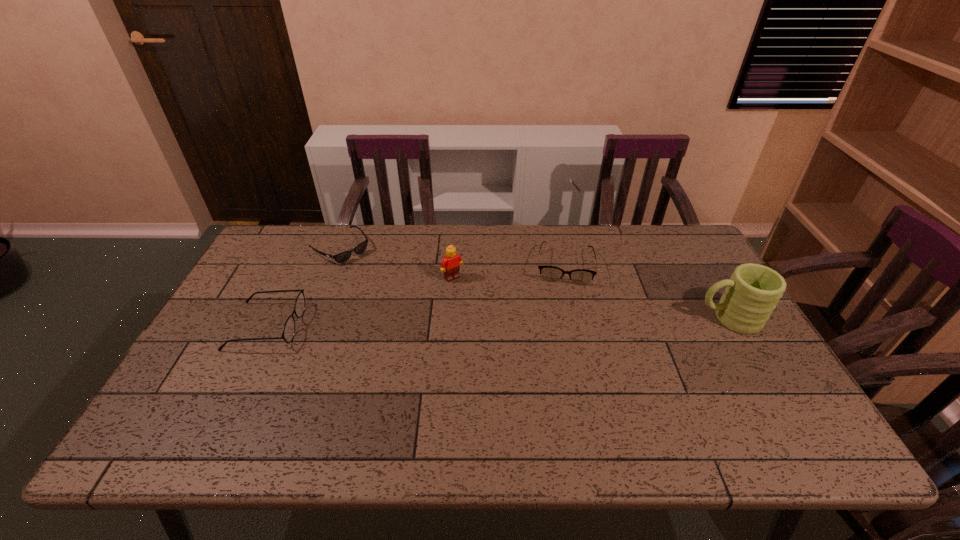
Identify the location of empty space that is in between the nearer spectacles and the fourth shortest object. The image size is (960, 540). (359, 302).

This screenshot has width=960, height=540. What are the coordinates of `free space between the tallest object and the third object from right to left` in the screenshot? It's located at (590, 298).

Locate an element on the screen. free space between the second tallest object and the sunglasses is located at coordinates (396, 262).

Locate an element on the screen. This screenshot has width=960, height=540. blank region between the sunglasses and the nearer spectacles is located at coordinates 303,287.

You are a GUI agent. You are given a task and a screenshot of the screen. Output one action in this format:
    pyautogui.click(x=<x>, y=<y>)
    Task: Click on the vacant space in between the mug and the fourth object from left to right
    
    Given the screenshot: What is the action you would take?
    pyautogui.click(x=646, y=292)

Where is `vacant area between the third object from left to right and the mug`? vacant area between the third object from left to right and the mug is located at coordinates (590, 298).

This screenshot has height=540, width=960. What are the coordinates of `free space that is in between the nearer spectacles and the mug` in the screenshot? It's located at (497, 322).

At what (x,y) coordinates should I click in order to perform the action: click on free area in between the nearer spectacles and the mug. Please return your answer as a coordinate pair (x, y). The height and width of the screenshot is (540, 960). Looking at the image, I should click on (497, 322).

Find the location of a particular element. vacant space in between the left spectacles and the tallest object is located at coordinates (497, 322).

The image size is (960, 540). Identify the location of free point between the second object from right to left and the nearer spectacles. (415, 295).